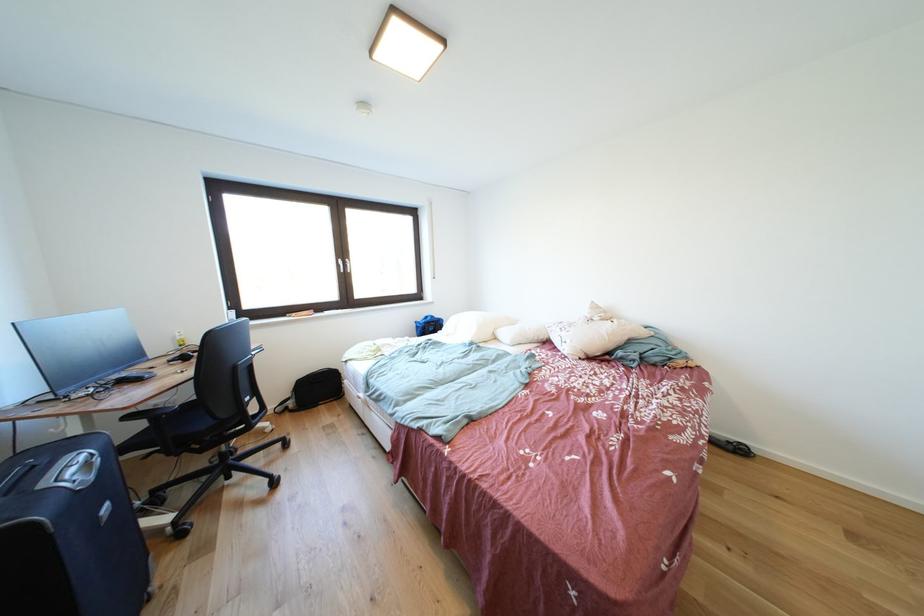
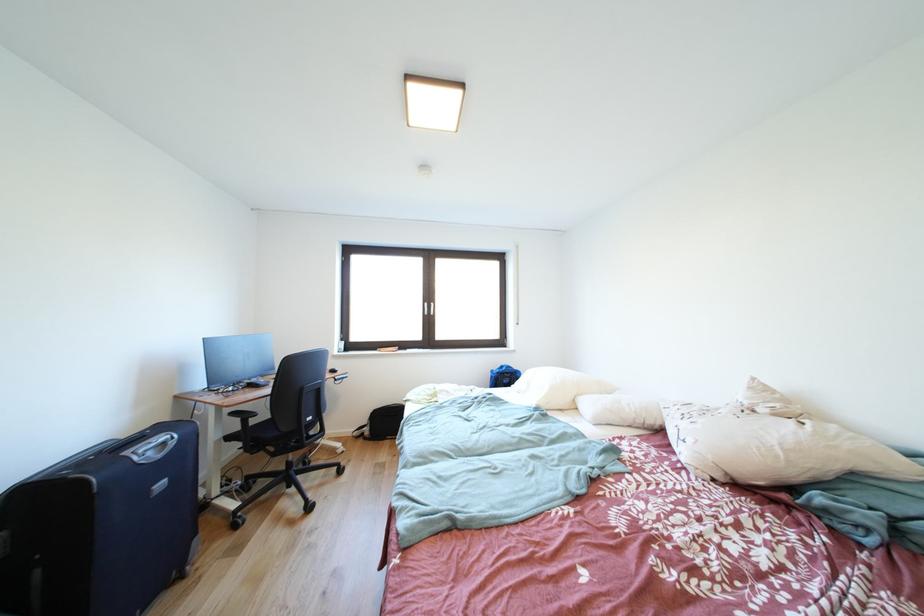
Question: The images are taken continuously from a first-person perspective. In which direction is your viewpoint rotating?

Choices:
 (A) Left
 (B) Right
 (C) Up
 (D) Down

Answer: (A)